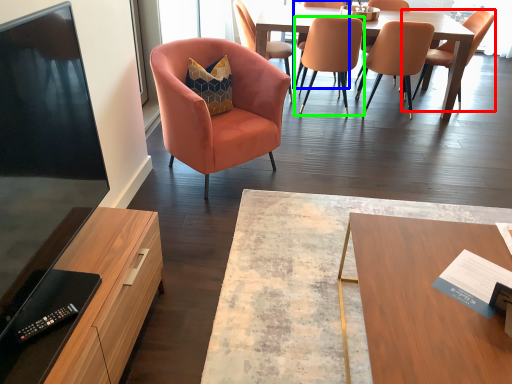
Question: Based on their relative distances, which object is farther from chair (highlighted by a red box)? Choose from chair (highlighted by a blue box) and chair (highlighted by a green box).

Choices:
 (A) chair
 (B) chair

Answer: (A)